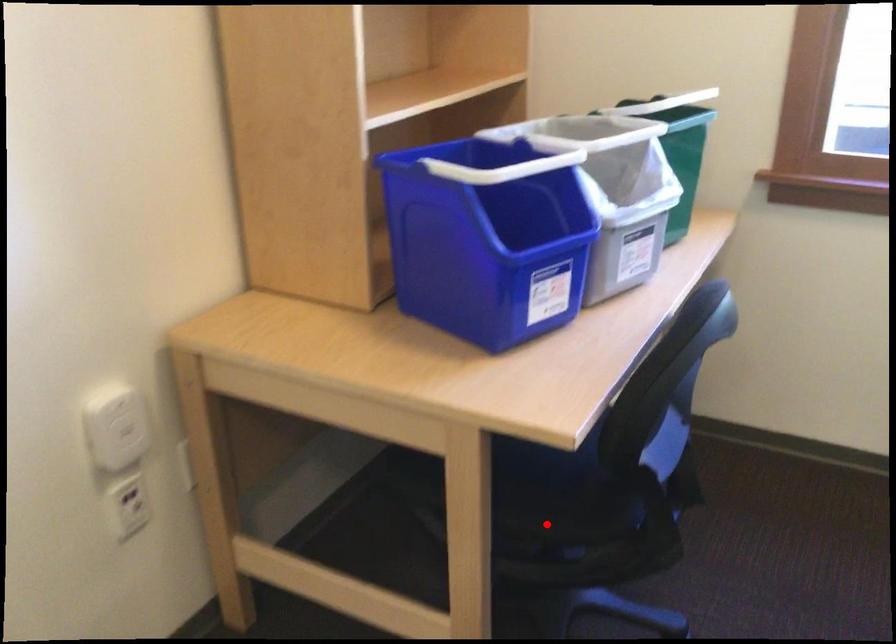
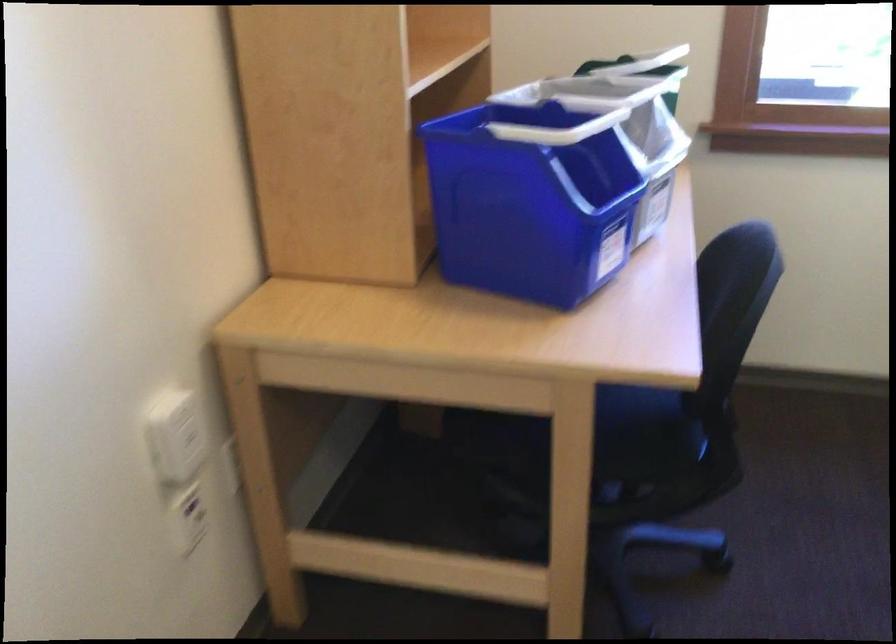
The point at the highlighted location is marked in the first image. Where is the corresponding point in the second image?

(625, 469)